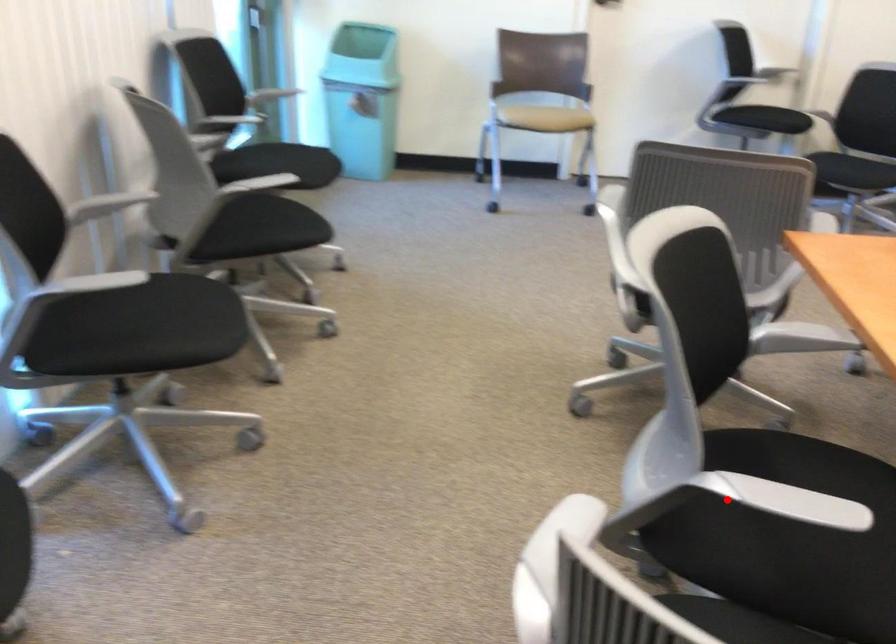
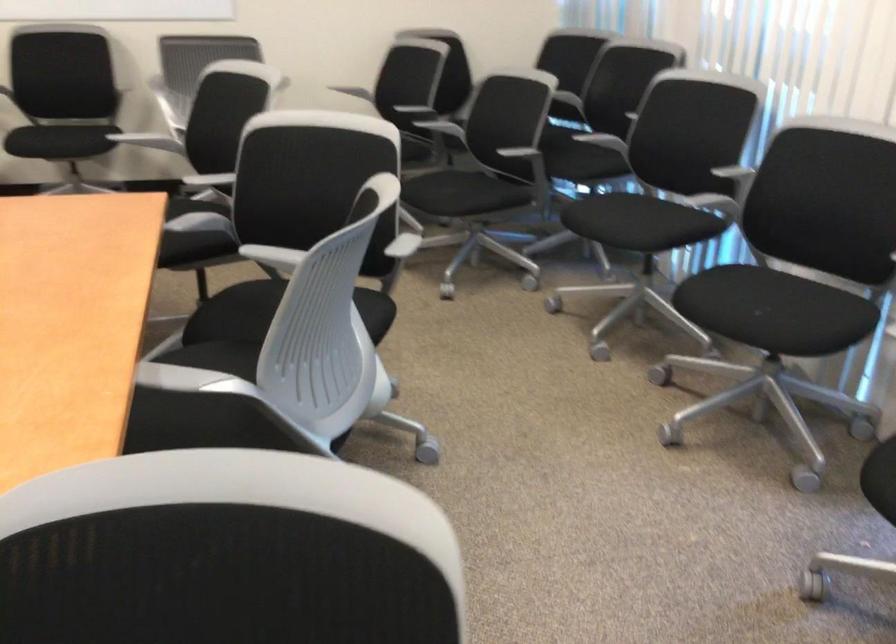
Question: I am providing you with two images of the same scene from different viewpoints. Given a red point in image1, look at the same physical point in image2. Is it:

Choices:
 (A) Closer to the viewpoint
 (B) Farther from the viewpoint

Answer: (B)